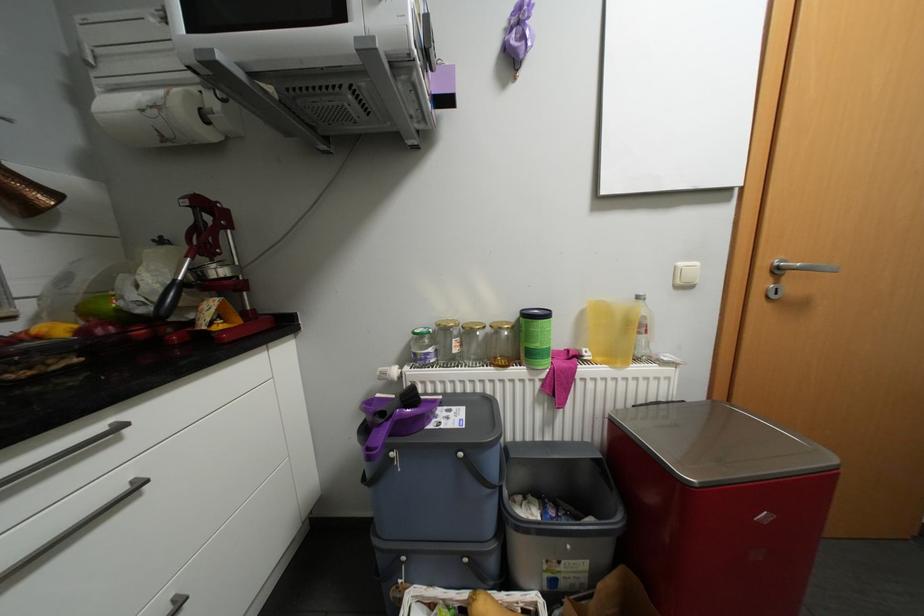
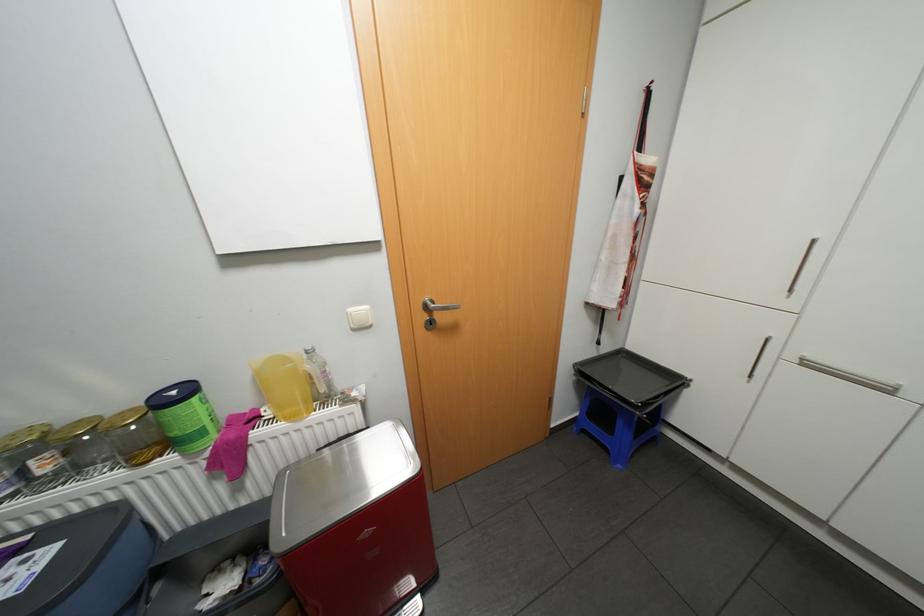
Where in the second image is the point corresponding to pixel 537 367 from the first image?

(190, 453)